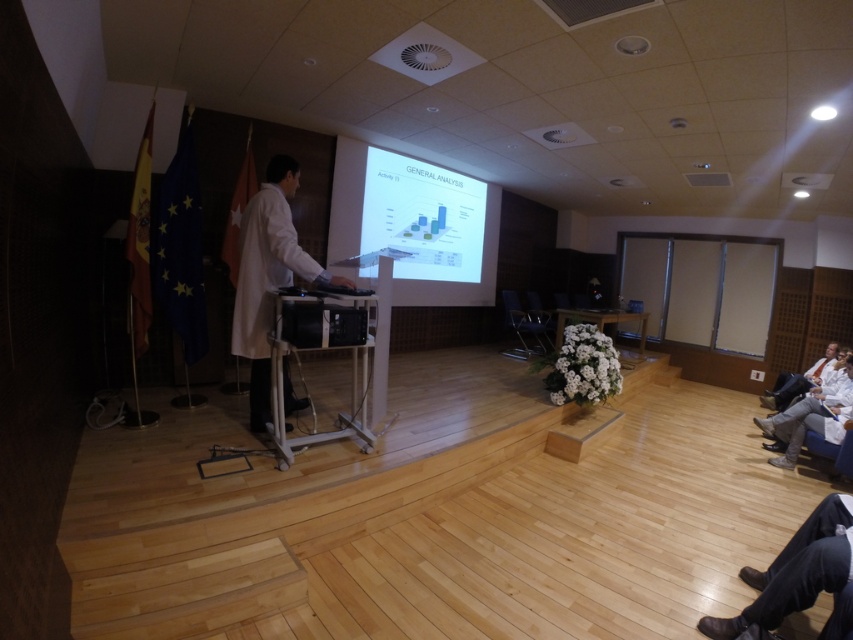
Between white matte coat at center and black plastic chair at center, which one has less height?

black plastic chair at center

Based on the photo, between white matte coat at center and black plastic chair at center, which one is positioned higher?

Positioned higher is white matte coat at center.

Which is behind, point (265, 396) or point (540, 340)?

Point (540, 340)

Find the location of a particular element. This screenshot has width=853, height=640. white matte coat at center is located at coordinates (268, 276).

Does brown leather shoes at lower right lie behind white plastic podium at center?

No, it is not.

The image size is (853, 640). What are the coordinates of `brown leather shoes at lower right` in the screenshot? It's located at (793, 573).

Does point (756, 598) lie in front of point (531, 349)?

Yes, it is in front of point (531, 349).

Is point (827, 589) behind point (550, 346)?

No.

Locate an element on the screen. The image size is (853, 640). brown leather shoes at lower right is located at coordinates (793, 573).